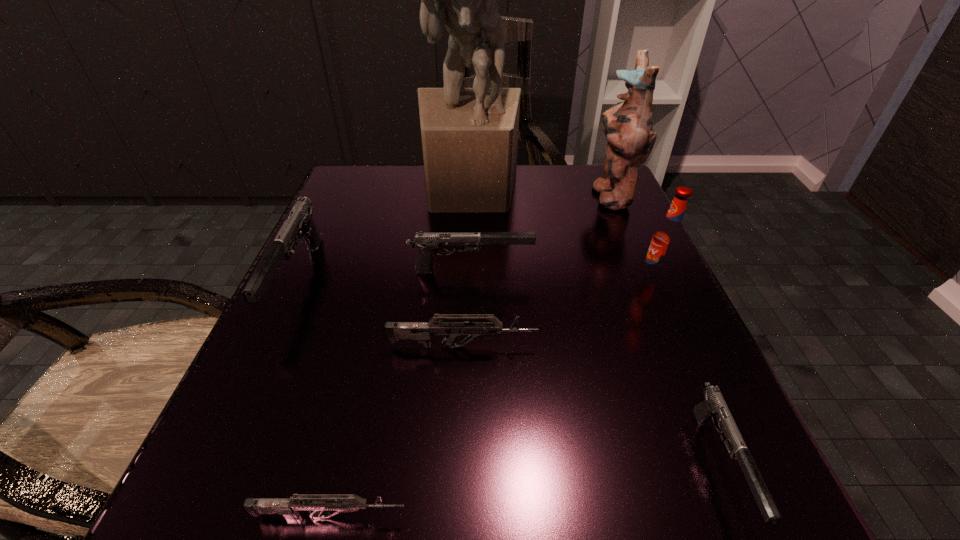
The image size is (960, 540). I want to click on vacant space located at the muzzle end of the second gray gun from right to left, so click(x=651, y=270).

Where is `vacant space located 0.100m aimed along the barrel of the farther grey gun`? vacant space located 0.100m aimed along the barrel of the farther grey gun is located at coordinates (604, 347).

I want to click on free region located aimed along the barrel of the nearer grey gun, so click(x=733, y=516).

Identify the location of sculpture that is at the far edge. This screenshot has width=960, height=540. (469, 135).

I want to click on figurine that is at the far edge, so click(628, 126).

In order to click on object present at the near edge in this screenshot , I will do `click(288, 507)`.

Find the location of `figurine that is at the right edge`. figurine that is at the right edge is located at coordinates (628, 126).

Where is `root beer situated at the right edge`? root beer situated at the right edge is located at coordinates (668, 239).

Where is `object at the near left corner`? object at the near left corner is located at coordinates (288, 507).

The width and height of the screenshot is (960, 540). In order to click on object that is at the far right corner in this screenshot , I will do `click(628, 126)`.